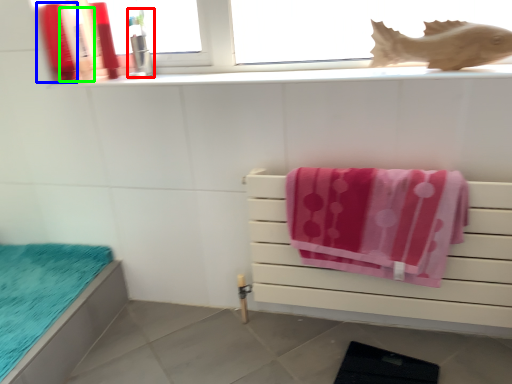
Question: Which is farther away from toiletry (highlighted by a red box)? toiletry (highlighted by a blue box) or toiletry (highlighted by a green box)?

Choices:
 (A) toiletry
 (B) toiletry

Answer: (A)